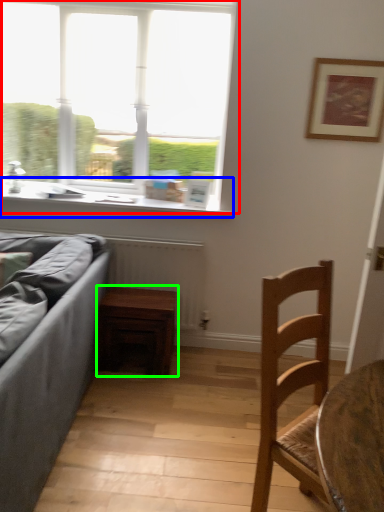
Question: Which object is positioned farthest from window (highlighted by a red box)? Select from window sill (highlighted by a blue box) and table (highlighted by a green box).

Choices:
 (A) window sill
 (B) table

Answer: (B)